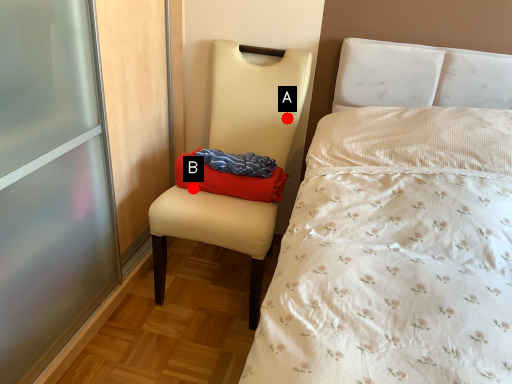
Question: Two points are circled on the image, labeled by A and B beside each circle. Which point is further to the camera?

Choices:
 (A) A is further
 (B) B is further

Answer: (A)